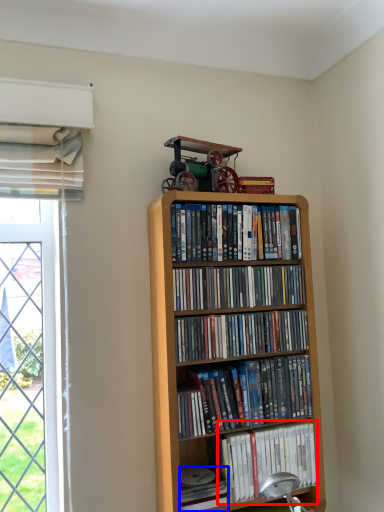
Question: Which object appears closest to the camera in this image, book (highlighted by a red box) or paperback book (highlighted by a blue box)?

Choices:
 (A) book
 (B) paperback book

Answer: (B)